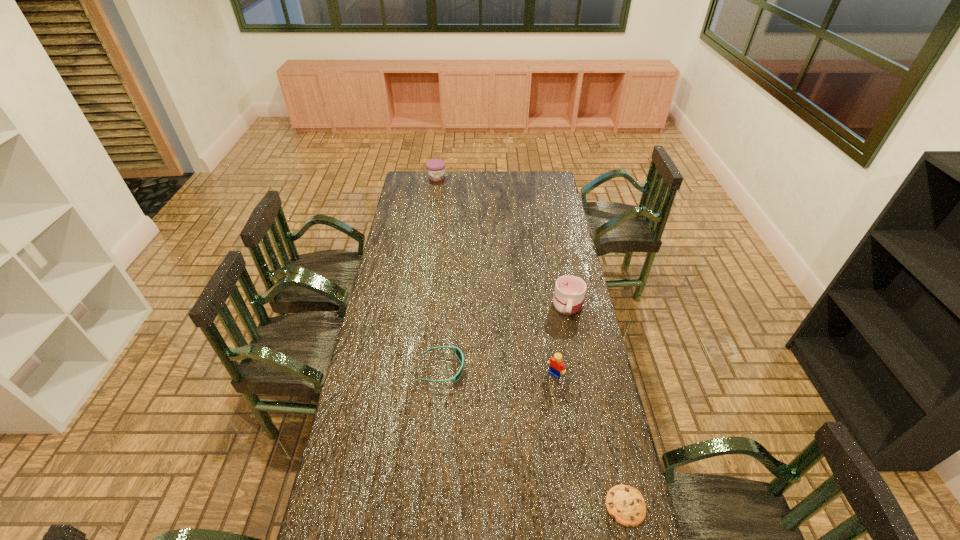
At what (x,y) coordinates should I click in order to perform the action: click on free space located 0.320m on the side with the handle of the second farthest object. Please return your answer as a coordinate pair (x, y). The height and width of the screenshot is (540, 960). Looking at the image, I should click on (555, 383).

Locate an element on the screen. The height and width of the screenshot is (540, 960). free space located 0.280m on the front label of the farthest object is located at coordinates (446, 208).

Where is `vacant space located on the front label of the farthest object`? This screenshot has height=540, width=960. vacant space located on the front label of the farthest object is located at coordinates (442, 194).

What are the coordinates of `free space located on the front label of the farthest object` in the screenshot? It's located at (448, 215).

Where is `free space located on the face of the third object from left to right`? Image resolution: width=960 pixels, height=540 pixels. free space located on the face of the third object from left to right is located at coordinates (484, 451).

You are a GUI agent. You are given a task and a screenshot of the screen. Output one action in this format:
    pyautogui.click(x=<x>, y=<y>)
    Task: Click on the vacant space situated on the face of the third object from left to right
    The image size is (960, 540).
    Given the screenshot: What is the action you would take?
    pyautogui.click(x=490, y=445)

The image size is (960, 540). I want to click on vacant space situated on the face of the third object from left to right, so click(521, 410).

In order to click on object at the far edge in this screenshot , I will do `click(435, 167)`.

Where is `object present at the near edge`? object present at the near edge is located at coordinates (625, 504).

At what (x,y) coordinates should I click in order to perform the action: click on object that is positioned at the left edge. Please return your answer as a coordinate pair (x, y). This screenshot has height=540, width=960. Looking at the image, I should click on (435, 167).